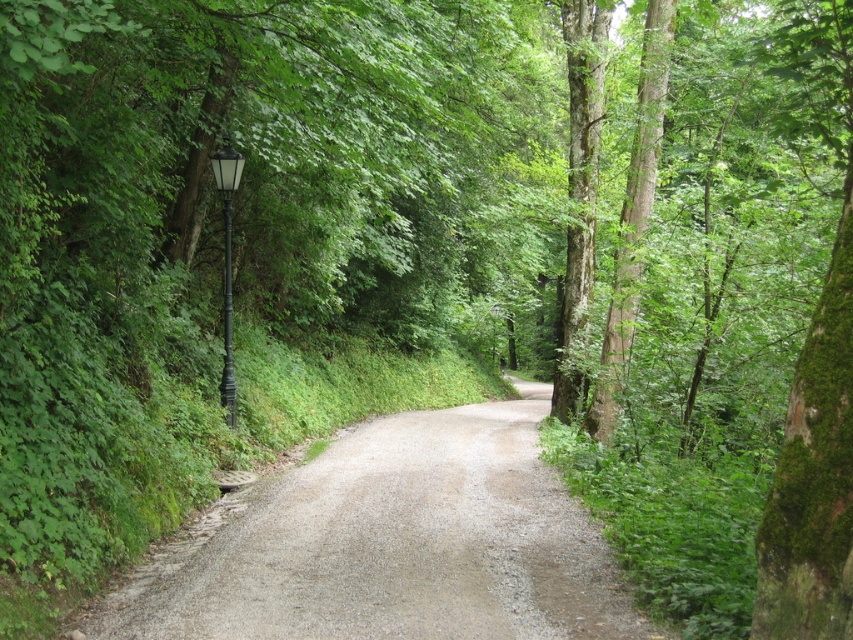
Which of these two, gray gravel trail at center or green rough bark tree at center, stands taller?

green rough bark tree at center

Does gray gravel trail at center have a larger size compared to green rough bark tree at center?

Yes.

You are a GUI agent. You are given a task and a screenshot of the screen. Output one action in this format:
    pyautogui.click(x=<x>, y=<y>)
    Task: Click on the gray gravel trail at center
    
    Given the screenshot: What is the action you would take?
    pyautogui.click(x=392, y=544)

Can you confirm if green rough bark tree at center is shorter than black metal lamp post at left?

Correct, green rough bark tree at center is not as tall as black metal lamp post at left.

Locate an element on the screen. The width and height of the screenshot is (853, 640). green rough bark tree at center is located at coordinates (633, 216).

Can you confirm if gray gravel trail at center is taller than black metal lamp post at left?

Incorrect, gray gravel trail at center's height is not larger of black metal lamp post at left's.

Does point (405, 451) come closer to viewer compared to point (231, 384)?

That is False.

Locate an element on the screen. Image resolution: width=853 pixels, height=640 pixels. gray gravel trail at center is located at coordinates (392, 544).